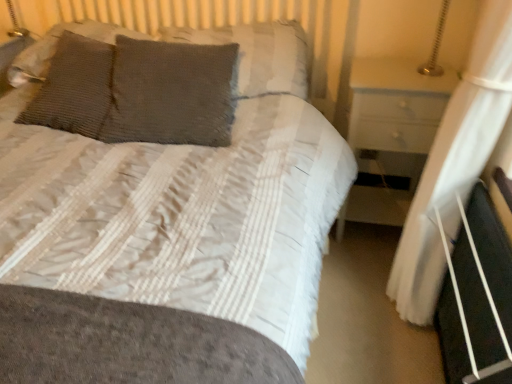
Measure the distance between point (490, 127) and camera.

They are 3.70 feet apart.

Locate an element on the screen. The width and height of the screenshot is (512, 384). gray textured pillow at center, positioned as the 1th pillow in right-to-left order is located at coordinates (258, 55).

This screenshot has width=512, height=384. Describe the element at coordinates (258, 55) in the screenshot. I see `gray textured pillow at center, positioned as the fourth pillow in left-to-right order` at that location.

The image size is (512, 384). What are the coordinates of `textured gray pillow at upper left, the 1th pillow from the left` in the screenshot? It's located at 56,45.

Find the location of a particular element. textured gray pillow at upper left, positioned as the second pillow in left-to-right order is located at coordinates (74, 88).

You are a GUI agent. You are given a task and a screenshot of the screen. Output one action in this format:
    pyautogui.click(x=<x>, y=<y>)
    Task: Click on the white glossy nightstand at right
    The image size is (512, 384).
    Given the screenshot: What is the action you would take?
    pyautogui.click(x=391, y=135)

This screenshot has width=512, height=384. Identify the location of white sheer curtain at right. (454, 163).

From the picture: Between black plastic bed frame at lower right and textured gray pillow at upper left, the third pillow when ordered from right to left, which one is positioned behind?

textured gray pillow at upper left, the third pillow when ordered from right to left, is behind.

Considering the sizes of objects black plastic bed frame at lower right and textured gray pillow at upper left, the third pillow when ordered from right to left, in the image provided, who is bigger, black plastic bed frame at lower right or textured gray pillow at upper left, the third pillow when ordered from right to left,?

textured gray pillow at upper left, the third pillow when ordered from right to left, is bigger.

From a real-world perspective, between black plastic bed frame at lower right and textured gray pillow at upper left, positioned as the second pillow in left-to-right order, who is vertically lower?

black plastic bed frame at lower right.

What's the angular difference between black plastic bed frame at lower right and textured gray pillow at upper left, positioned as the second pillow in left-to-right order,'s facing directions?

The angular difference between black plastic bed frame at lower right and textured gray pillow at upper left, positioned as the second pillow in left-to-right order, is 80.9 degrees.

Considering the relative sizes of white glossy nightstand at right and gray knitted pillow at center, which is counted as the third pillow, starting from the left, in the image provided, is white glossy nightstand at right thinner than gray knitted pillow at center, which is counted as the third pillow, starting from the left,?

In fact, white glossy nightstand at right might be wider than gray knitted pillow at center, which is counted as the third pillow, starting from the left.

Is white glossy nightstand at right far from gray knitted pillow at center, positioned as the 2th pillow in right-to-left order?

No, white glossy nightstand at right is not far away from gray knitted pillow at center, positioned as the 2th pillow in right-to-left order.

From the image's perspective, is white glossy nightstand at right located above or below gray knitted pillow at center, positioned as the 2th pillow in right-to-left order?

Based on their image positions, white glossy nightstand at right is located beneath gray knitted pillow at center, positioned as the 2th pillow in right-to-left order.

Is point (401, 100) positioned behind point (228, 127)?

No, it is in front of (228, 127).

Is gray textured pillow at center, positioned as the 1th pillow in right-to-left order, next to textured gray pillow at upper left, the third pillow when ordered from right to left?

gray textured pillow at center, positioned as the 1th pillow in right-to-left order, and textured gray pillow at upper left, the third pillow when ordered from right to left, are not in contact.

Can you confirm if gray textured pillow at center, positioned as the fourth pillow in left-to-right order, is shorter than textured gray pillow at upper left, the third pillow when ordered from right to left?

Yes.

From the image's perspective, which one is positioned lower, gray textured pillow at center, positioned as the 1th pillow in right-to-left order, or textured gray pillow at upper left, the third pillow when ordered from right to left?

textured gray pillow at upper left, the third pillow when ordered from right to left, appears lower in the image.

Is textured gray pillow at upper left, positioned as the second pillow in left-to-right order, completely or partially inside gray textured pillow at center, positioned as the 1th pillow in right-to-left order?

Definitely not — textured gray pillow at upper left, positioned as the second pillow in left-to-right order, is not inside gray textured pillow at center, positioned as the 1th pillow in right-to-left order.

Is white sheer curtain at right positioned far away from white glossy nightstand at right?

Actually, white sheer curtain at right and white glossy nightstand at right are a little close together.

From a real-world perspective, which object stands above the other?

white sheer curtain at right, from a real-world perspective.

Based on the photo, can you confirm if white sheer curtain at right is thinner than white glossy nightstand at right?

Correct, the width of white sheer curtain at right is less than that of white glossy nightstand at right.

Could you tell me if white sheer curtain at right is turned towards white glossy nightstand at right?

No, white sheer curtain at right does not turn towards white glossy nightstand at right.

In the image, is textured gray pillow at upper left, the 1th pillow from the left, positioned in front of or behind textured gray pillow at upper left, positioned as the second pillow in left-to-right order?

textured gray pillow at upper left, the 1th pillow from the left, is behind textured gray pillow at upper left, positioned as the second pillow in left-to-right order.

Can you tell me how much textured gray pillow at upper left, the 1th pillow from the left, and textured gray pillow at upper left, the third pillow when ordered from right to left, differ in facing direction?

6.83 degrees.

Does point (147, 37) come in front of point (41, 98)?

No, it is behind (41, 98).

From the image's perspective, is textured gray pillow at upper left, the 4th pillow viewed from the right, below textured gray pillow at upper left, the third pillow when ordered from right to left?

No.

In terms of size, does black plastic bed frame at lower right appear bigger or smaller than gray knitted pillow at center, which is counted as the third pillow, starting from the left?

Considering their sizes, black plastic bed frame at lower right takes up less space than gray knitted pillow at center, which is counted as the third pillow, starting from the left.

Which pillow is the 1st one when counting from the back of the black plastic bed frame at lower right? Please provide its 2D coordinates.

[(170, 93)]

Is black plastic bed frame at lower right far from gray knitted pillow at center, positioned as the 2th pillow in right-to-left order?

That's right, there is a large distance between black plastic bed frame at lower right and gray knitted pillow at center, positioned as the 2th pillow in right-to-left order.

From a real-world perspective, is black plastic bed frame at lower right above or below gray knitted pillow at center, which is counted as the third pillow, starting from the left?

black plastic bed frame at lower right is below gray knitted pillow at center, which is counted as the third pillow, starting from the left.

Is gray knitted pillow at center, which is counted as the third pillow, starting from the left, in front of or behind white sheer curtain at right in the image?

gray knitted pillow at center, which is counted as the third pillow, starting from the left, is positioned farther from the viewer than white sheer curtain at right.

Is gray knitted pillow at center, positioned as the 2th pillow in right-to-left order, oriented towards white sheer curtain at right?

No, gray knitted pillow at center, positioned as the 2th pillow in right-to-left order, does not turn towards white sheer curtain at right.

In the scene shown: Are gray knitted pillow at center, which is counted as the third pillow, starting from the left, and white sheer curtain at right far apart?

No.

Would you say gray knitted pillow at center, which is counted as the third pillow, starting from the left, contains white sheer curtain at right?

Actually, white sheer curtain at right is outside gray knitted pillow at center, which is counted as the third pillow, starting from the left.

Locate an element on the screen. bed frame located on the right of textured gray pillow at upper left, positioned as the second pillow in left-to-right order is located at coordinates (477, 299).

At what (x,y) coordinates should I click in order to perform the action: click on the 2nd pillow directly above the white glossy nightstand at right (from a real-world perspective). Please return your answer as a coordinate pair (x, y). This screenshot has height=384, width=512. Looking at the image, I should click on (170, 93).

Estimate the real-world distances between objects in this image. Which object is further from gray knitted pillow at center, which is counted as the third pillow, starting from the left, textured gray pillow at upper left, positioned as the second pillow in left-to-right order, or gray textured pillow at center, positioned as the 1th pillow in right-to-left order?

gray textured pillow at center, positioned as the 1th pillow in right-to-left order, is further to gray knitted pillow at center, which is counted as the third pillow, starting from the left.

Estimate the real-world distances between objects in this image. Which object is closer to white glossy nightstand at right, black plastic bed frame at lower right or gray textured pillow at center, positioned as the fourth pillow in left-to-right order?

The object closer to white glossy nightstand at right is gray textured pillow at center, positioned as the fourth pillow in left-to-right order.

Which object lies further to the anchor point gray knitted pillow at center, positioned as the 2th pillow in right-to-left order, gray textured pillow at center, positioned as the fourth pillow in left-to-right order, or white sheer curtain at right?

Based on the image, white sheer curtain at right appears to be further to gray knitted pillow at center, positioned as the 2th pillow in right-to-left order.

Based on their spatial positions, is textured gray pillow at upper left, the third pillow when ordered from right to left, or white glossy nightstand at right closer to gray textured pillow at center, positioned as the fourth pillow in left-to-right order?

white glossy nightstand at right.

Looking at the image, which one is located further to gray textured pillow at center, positioned as the fourth pillow in left-to-right order, textured gray pillow at upper left, the 1th pillow from the left, or textured gray pillow at upper left, the third pillow when ordered from right to left?

The object further to gray textured pillow at center, positioned as the fourth pillow in left-to-right order, is textured gray pillow at upper left, the third pillow when ordered from right to left.

Estimate the real-world distances between objects in this image. Which object is closer to white glossy nightstand at right, textured gray pillow at upper left, the third pillow when ordered from right to left, or white sheer curtain at right?

white sheer curtain at right is closer to white glossy nightstand at right.

Looking at this image, considering their positions, is white glossy nightstand at right positioned further to gray textured pillow at center, positioned as the 1th pillow in right-to-left order, than textured gray pillow at upper left, the 1th pillow from the left?

textured gray pillow at upper left, the 1th pillow from the left, is further to gray textured pillow at center, positioned as the 1th pillow in right-to-left order.

Estimate the real-world distances between objects in this image. Which object is closer to textured gray pillow at upper left, the 1th pillow from the left, gray textured pillow at center, positioned as the fourth pillow in left-to-right order, or black plastic bed frame at lower right?

Among the two, gray textured pillow at center, positioned as the fourth pillow in left-to-right order, is located nearer to textured gray pillow at upper left, the 1th pillow from the left.

Locate an element on the screen. This screenshot has height=384, width=512. bed frame between white sheer curtain at right and white glossy nightstand at right from front to back is located at coordinates (477, 299).

The width and height of the screenshot is (512, 384). In order to click on curtain between gray knitted pillow at center, positioned as the 2th pillow in right-to-left order, and white glossy nightstand at right, in the horizontal direction in this screenshot , I will do `click(454, 163)`.

Where is `curtain between gray textured pillow at center, positioned as the 1th pillow in right-to-left order, and black plastic bed frame at lower right, in the vertical direction`? curtain between gray textured pillow at center, positioned as the 1th pillow in right-to-left order, and black plastic bed frame at lower right, in the vertical direction is located at coordinates (454, 163).

Locate an element on the screen. This screenshot has height=384, width=512. curtain between textured gray pillow at upper left, the 1th pillow from the left, and black plastic bed frame at lower right is located at coordinates (454, 163).